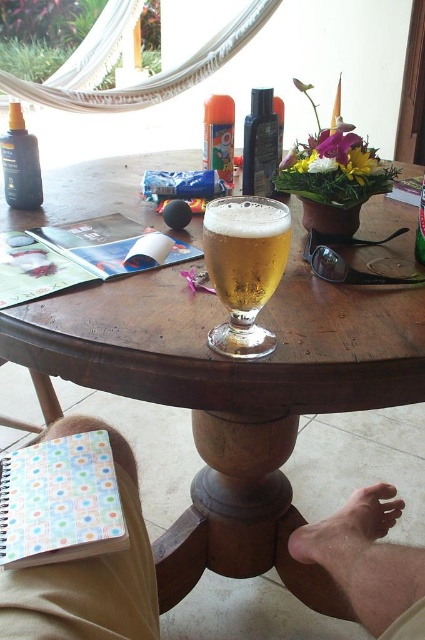
Which is behind, point (342, 560) or point (278, 131)?

The point (278, 131) is more distant.

Image resolution: width=425 pixels, height=640 pixels. What do you see at coordinates (354, 534) in the screenshot? I see `pale skin foot at lower center` at bounding box center [354, 534].

At what (x,y) coordinates should I click in order to perform the action: click on pale skin foot at lower center. Please return your answer as a coordinate pair (x, y). The width and height of the screenshot is (425, 640). Looking at the image, I should click on (354, 534).

Does skinny tan leg at lower center have a larger size compared to matte black lotion at upper left?

Indeed, skinny tan leg at lower center has a larger size compared to matte black lotion at upper left.

Between point (373, 620) and point (33, 204), which one is positioned in front?

Positioned in front is point (373, 620).

Find the location of a particular element. The image size is (425, 640). skinny tan leg at lower center is located at coordinates (88, 573).

Can you confirm if wooden table at center is positioned to the left of golden glass beer at center?

Yes, wooden table at center is to the left of golden glass beer at center.

Is wooden table at center positioned before golden glass beer at center?

No.

Who is more forward, [175,572] or [272,349]?

Point [272,349]

The width and height of the screenshot is (425, 640). I want to click on wooden table at center, so click(x=246, y=392).